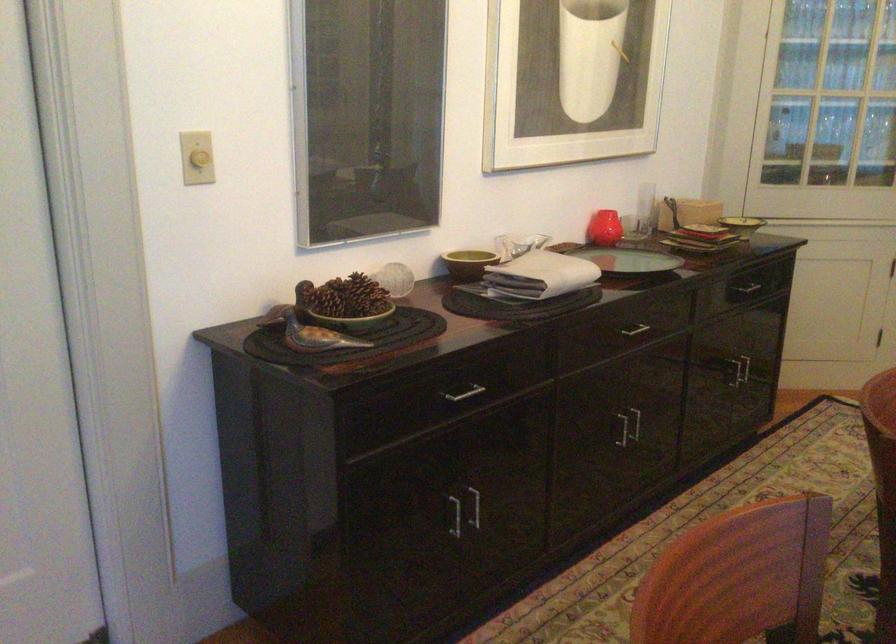
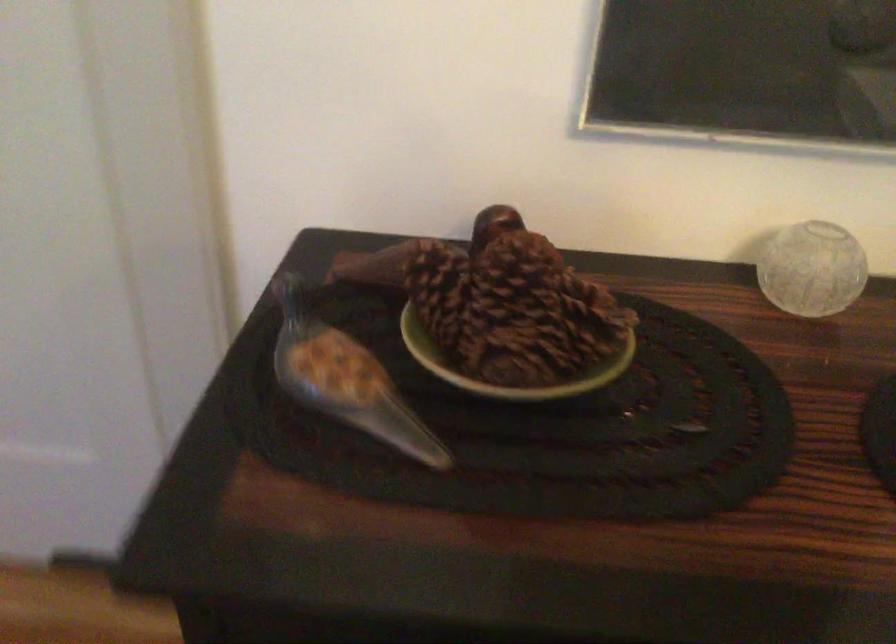
Find the pixel in the second image that matches pixel 365 301 in the first image.

(506, 366)